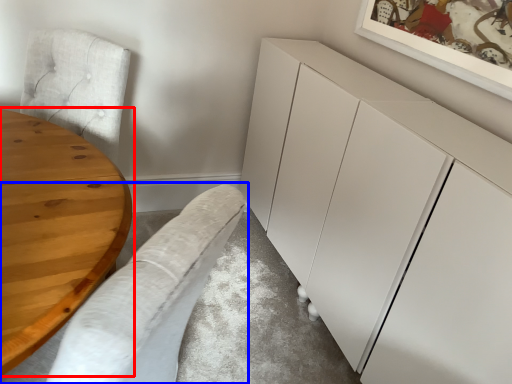
Question: Which point is closer to the camera, table (highlighted by a red box) or couch (highlighted by a blue box)?

Choices:
 (A) table
 (B) couch

Answer: (B)